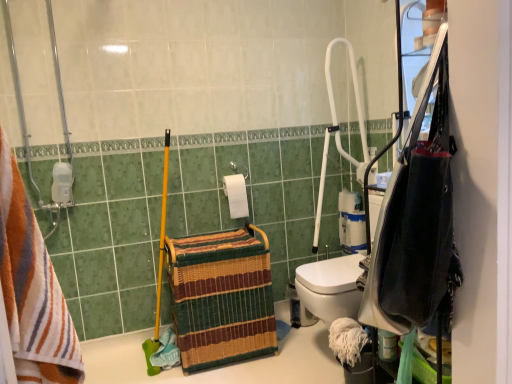
Question: Considering the positions of white matte toilet paper at center, positioned as the 2th toilet paper in right-to-left order, and woven straw basket at center in the image, is white matte toilet paper at center, positioned as the 2th toilet paper in right-to-left order, wider or thinner than woven straw basket at center?

Choices:
 (A) thin
 (B) wide

Answer: (A)

Question: Does point (233, 216) appear closer or farther from the camera than point (260, 231)?

Choices:
 (A) closer
 (B) farther

Answer: (B)

Question: Which is farther from the woven straw basket at center?

Choices:
 (A) black fabric bag at right
 (B) white plastic shower at upper right
 (C) white matte toilet paper at center, the first toilet paper viewed from the left
 (D) white matte toilet paper at center-right, the second toilet paper in the left-to-right sequence
 (E) striped cotton towel at left

Answer: (E)

Question: Which object is the farthest from the white matte toilet paper at center-right, arranged as the first toilet paper when viewed from the back?

Choices:
 (A) striped cotton towel at left
 (B) white matte toilet paper at center, the first toilet paper viewed from the left
 (C) woven straw basket at center
 (D) white plastic shower at upper right
 (E) black fabric bag at right

Answer: (A)